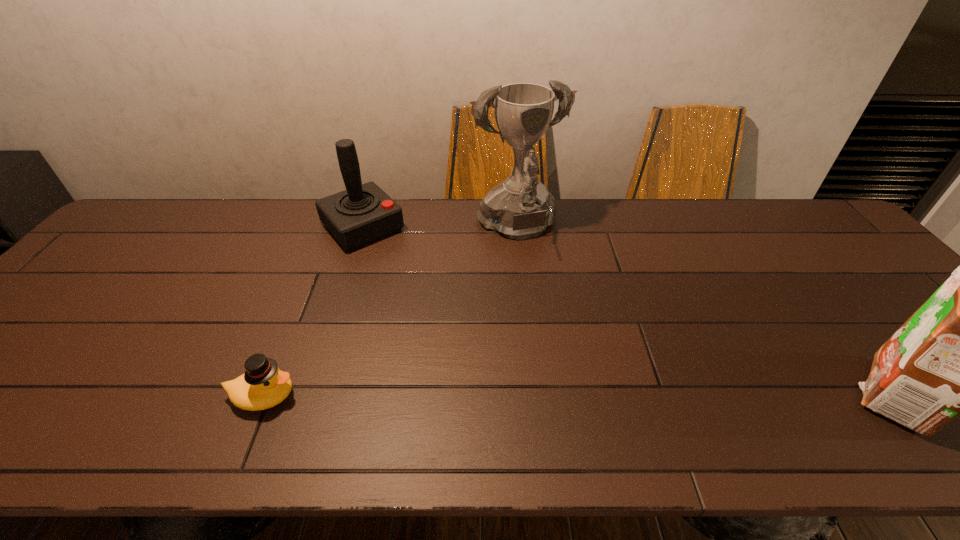
You are a GUI agent. You are given a task and a screenshot of the screen. Output one action in this format:
    pyautogui.click(x=<x>, y=<y>)
    Task: Click on the free space located on the base of the joystick
    The height and width of the screenshot is (540, 960).
    Given the screenshot: What is the action you would take?
    pyautogui.click(x=393, y=259)

What are the coordinates of `award that is at the far edge` in the screenshot? It's located at (521, 207).

Where is `joystick at the far edge`? The width and height of the screenshot is (960, 540). joystick at the far edge is located at coordinates (363, 213).

The height and width of the screenshot is (540, 960). In order to click on object that is at the near edge in this screenshot , I will do `click(263, 385)`.

In the image, there is a desktop. In order to click on free space at the far edge in this screenshot , I will do `click(660, 239)`.

Where is `blank area at the near edge`? blank area at the near edge is located at coordinates (506, 392).

Locate an element on the screen. The height and width of the screenshot is (540, 960). vacant space at the left edge of the desktop is located at coordinates (114, 255).

In order to click on free space at the right edge of the desktop in this screenshot , I will do `click(889, 316)`.

The height and width of the screenshot is (540, 960). In the image, there is a desktop. Identify the location of free region at the far left corner. (148, 211).

Where is `free space between the shortest object and the third object from left to right`? free space between the shortest object and the third object from left to right is located at coordinates (391, 313).